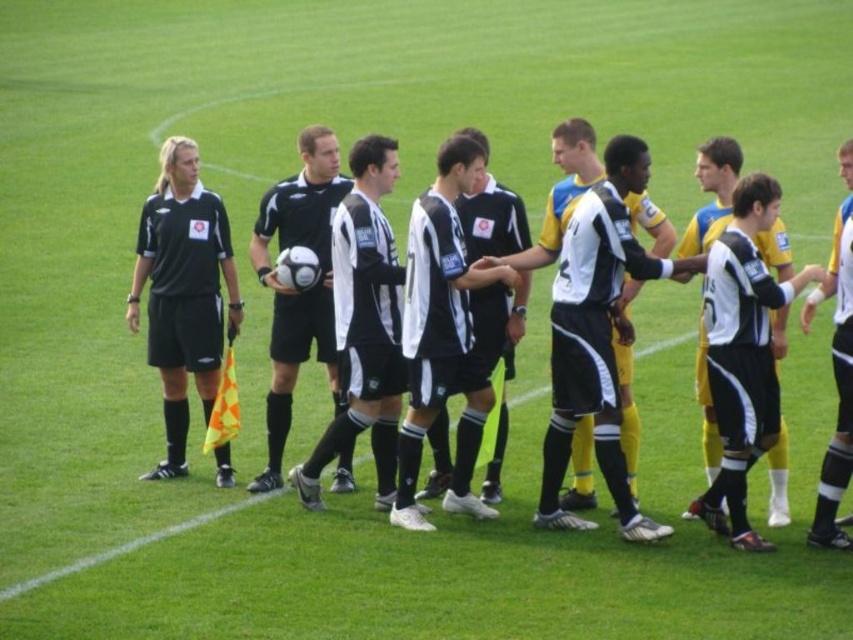
Is matte black referee at left above yellow/black jersey at center?

Yes, matte black referee at left is above yellow/black jersey at center.

Between matte black referee at left and yellow/black jersey at center, which one appears on the left side from the viewer's perspective?

matte black referee at left is more to the left.

What do you see at coordinates (183, 291) in the screenshot? I see `matte black referee at left` at bounding box center [183, 291].

This screenshot has width=853, height=640. Identify the location of matte black referee at left. (183, 291).

Is matte black referee at left positioned before black matte soccer ball at center?

No, matte black referee at left is further to the viewer.

Based on the photo, which is more to the left, matte black referee at left or black matte soccer ball at center?

matte black referee at left

Between point (184, 291) and point (334, 173), which one is positioned in front?

Point (184, 291) is in front.

What are the coordinates of `matte black referee at left` in the screenshot? It's located at (183, 291).

Can you confirm if black matte soccer ball at center is positioned above yellow/black jersey at center?

Yes, black matte soccer ball at center is above yellow/black jersey at center.

Locate an element on the screen. black matte soccer ball at center is located at coordinates (300, 291).

Does point (334, 198) come farther from viewer compared to point (845, 161)?

Yes, it is.

Identify the location of black matte soccer ball at center. (300, 291).